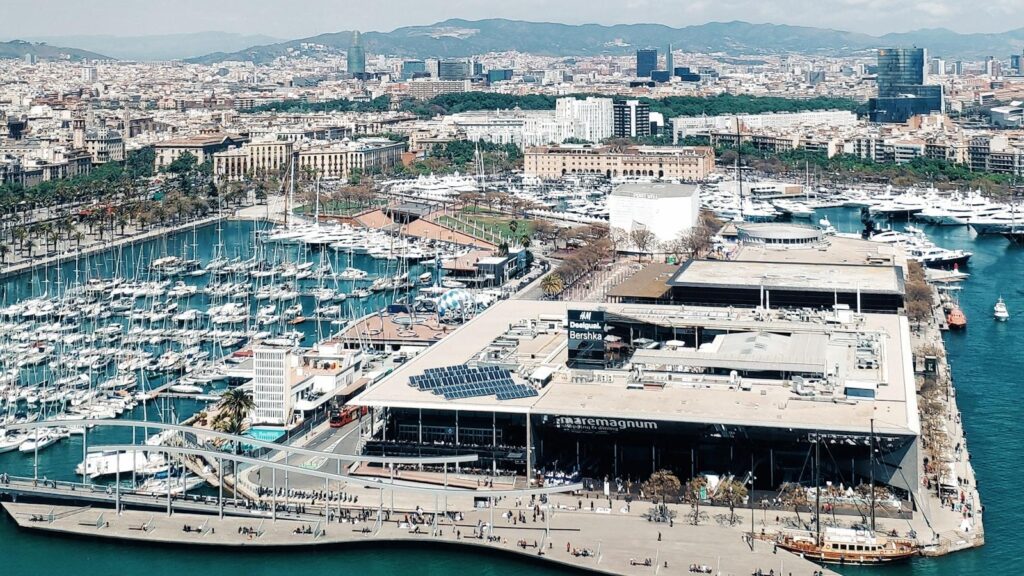
Identify the location of trolley. (347, 412).